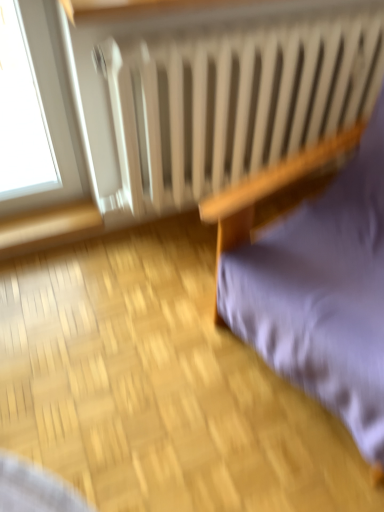
Locate an element on the screen. purple fabric cushion at right is located at coordinates 315,286.

Describe the element at coordinates (315, 286) in the screenshot. This screenshot has width=384, height=512. I see `purple fabric cushion at right` at that location.

Find the location of `white matte radiator at upper center`. white matte radiator at upper center is located at coordinates (233, 99).

What do you see at coordinates (233, 99) in the screenshot?
I see `white matte radiator at upper center` at bounding box center [233, 99].

Find the location of `purple fabric cushion at right`. purple fabric cushion at right is located at coordinates (315, 286).

Visually, is purple fabric cushion at right positioned to the left or to the right of white matte radiator at upper center?

In the image, purple fabric cushion at right appears on the right side of white matte radiator at upper center.

Is the depth of purple fabric cushion at right less than that of white matte radiator at upper center?

Yes, purple fabric cushion at right is in front of white matte radiator at upper center.

Considering the points (375, 373) and (157, 167), which point is behind, point (375, 373) or point (157, 167)?

Positioned behind is point (157, 167).

From the image's perspective, is purple fabric cushion at right below white matte radiator at upper center?

Indeed, from the image's perspective, purple fabric cushion at right is shown beneath white matte radiator at upper center.

From a real-world perspective, is purple fabric cushion at right above or below white matte radiator at upper center?

In terms of real-world spatial position, purple fabric cushion at right is above white matte radiator at upper center.

Does purple fabric cushion at right have a lesser width compared to white matte radiator at upper center?

In fact, purple fabric cushion at right might be wider than white matte radiator at upper center.

Between purple fabric cushion at right and white matte radiator at upper center, which one has less height?

With less height is purple fabric cushion at right.

Based on their sizes in the image, would you say purple fabric cushion at right is bigger or smaller than white matte radiator at upper center?

Considering their sizes, purple fabric cushion at right takes up more space than white matte radiator at upper center.

Is purple fabric cushion at right outside of white matte radiator at upper center?

Yes, purple fabric cushion at right is not within white matte radiator at upper center.

Is purple fabric cushion at right not near white matte radiator at upper center?

Actually, purple fabric cushion at right and white matte radiator at upper center are a little close together.

Looking at this image, is purple fabric cushion at right looking in the opposite direction of white matte radiator at upper center?

purple fabric cushion at right does not have its back to white matte radiator at upper center.

How different are the orientations of purple fabric cushion at right and white matte radiator at upper center in degrees?

The angle between the facing direction of purple fabric cushion at right and the facing direction of white matte radiator at upper center is 73.4 degrees.

I want to click on radiator behind the purple fabric cushion at right, so click(233, 99).

Which object is positioned more to the left, white matte radiator at upper center or purple fabric cushion at right?

Positioned to the left is white matte radiator at upper center.

From the picture: Is white matte radiator at upper center closer to the viewer compared to purple fabric cushion at right?

No, white matte radiator at upper center is further to the viewer.

Is point (356, 2) farther from camera compared to point (345, 375)?

Yes.

From the image's perspective, which is below, white matte radiator at upper center or purple fabric cushion at right?

purple fabric cushion at right appears lower in the image.

Looking at this image, from a real-world perspective, is white matte radiator at upper center beneath purple fabric cushion at right?

Indeed, from a real-world perspective, white matte radiator at upper center is positioned beneath purple fabric cushion at right.

In terms of width, does white matte radiator at upper center look wider or thinner when compared to purple fabric cushion at right?

white matte radiator at upper center is thinner than purple fabric cushion at right.

Considering the sizes of white matte radiator at upper center and purple fabric cushion at right in the image, is white matte radiator at upper center taller or shorter than purple fabric cushion at right?

white matte radiator at upper center is taller than purple fabric cushion at right.

Can you confirm if white matte radiator at upper center is smaller than purple fabric cushion at right?

Indeed, white matte radiator at upper center has a smaller size compared to purple fabric cushion at right.

Is white matte radiator at upper center not within purple fabric cushion at right?

That's correct, white matte radiator at upper center is outside of purple fabric cushion at right.

Would you say white matte radiator at upper center is a long distance from purple fabric cushion at right?

white matte radiator at upper center is near purple fabric cushion at right, not far away.

Is white matte radiator at upper center facing away from purple fabric cushion at right?

Yes, white matte radiator at upper center's orientation is away from purple fabric cushion at right.

Can you tell me how much white matte radiator at upper center and purple fabric cushion at right differ in facing direction?

The angle between the facing direction of white matte radiator at upper center and the facing direction of purple fabric cushion at right is 73.4 degrees.

Measure the distance between white matte radiator at upper center and purple fabric cushion at right.

white matte radiator at upper center is 18.14 inches away from purple fabric cushion at right.

You are a GUI agent. You are given a task and a screenshot of the screen. Output one action in this format:
    pyautogui.click(x=<x>, y=<y>)
    Task: Click on the furniture lying on the right of white matte radiator at upper center
    
    Given the screenshot: What is the action you would take?
    pyautogui.click(x=315, y=286)

Locate an element on the screen. furniture above the white matte radiator at upper center (from a real-world perspective) is located at coordinates (315, 286).

Locate an element on the screen. furniture lying below the white matte radiator at upper center (from the image's perspective) is located at coordinates (315, 286).